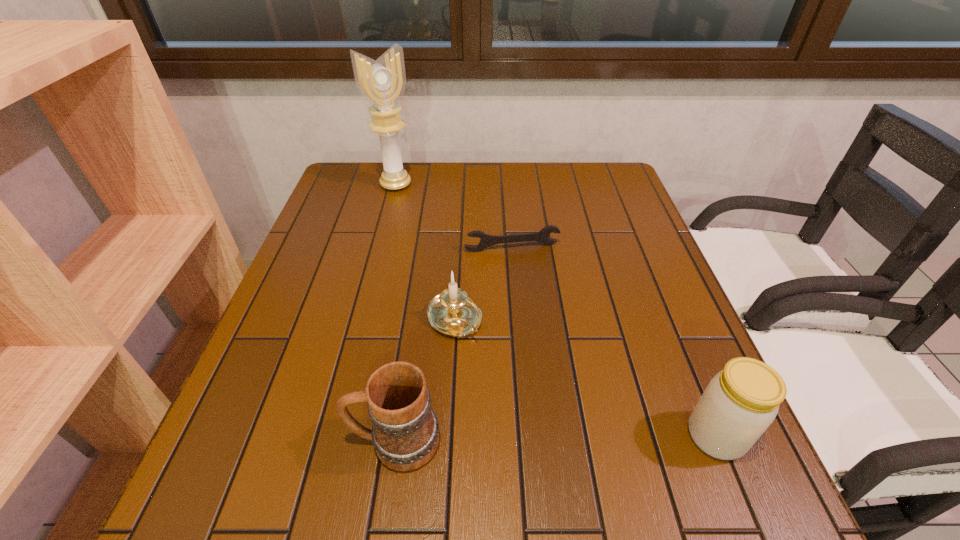
In order to click on mug in this screenshot , I will do `click(405, 434)`.

You are a GUI agent. You are given a task and a screenshot of the screen. Output one action in this format:
    pyautogui.click(x=<x>, y=<y>)
    Task: Click on the rightmost object
    The height and width of the screenshot is (540, 960).
    Given the screenshot: What is the action you would take?
    pyautogui.click(x=741, y=401)

I want to click on the fourth nearest object, so click(x=486, y=240).

Locate an element on the screen. Image resolution: width=960 pixels, height=540 pixels. the shortest object is located at coordinates (486, 240).

You are a GUI agent. You are given a task and a screenshot of the screen. Output one action in this format:
    pyautogui.click(x=<x>, y=<y>)
    Task: Click on the tallest object
    
    Given the screenshot: What is the action you would take?
    pyautogui.click(x=382, y=82)

This screenshot has height=540, width=960. Find the location of `the farthest object`. the farthest object is located at coordinates (382, 82).

Image resolution: width=960 pixels, height=540 pixels. In order to click on the third nearest object in this screenshot , I will do `click(453, 313)`.

Locate an element on the screen. The width and height of the screenshot is (960, 540). the second shortest object is located at coordinates (453, 313).

Locate an element on the screen. The image size is (960, 540). free space located 0.070m on the side of the mug with the handle is located at coordinates (308, 441).

Where is `vacant space positioned 0.170m on the side of the mug with the handle`? Image resolution: width=960 pixels, height=540 pixels. vacant space positioned 0.170m on the side of the mug with the handle is located at coordinates (250, 441).